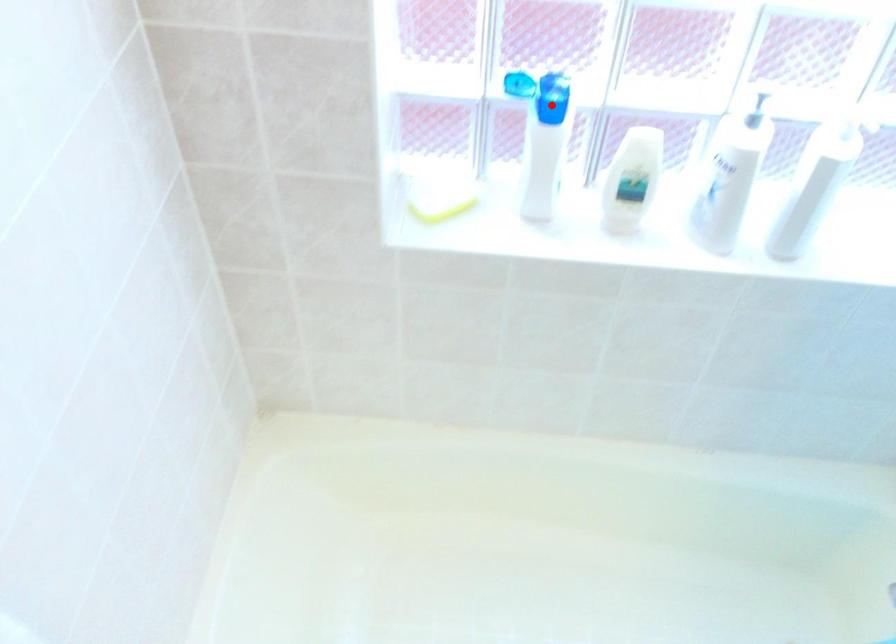
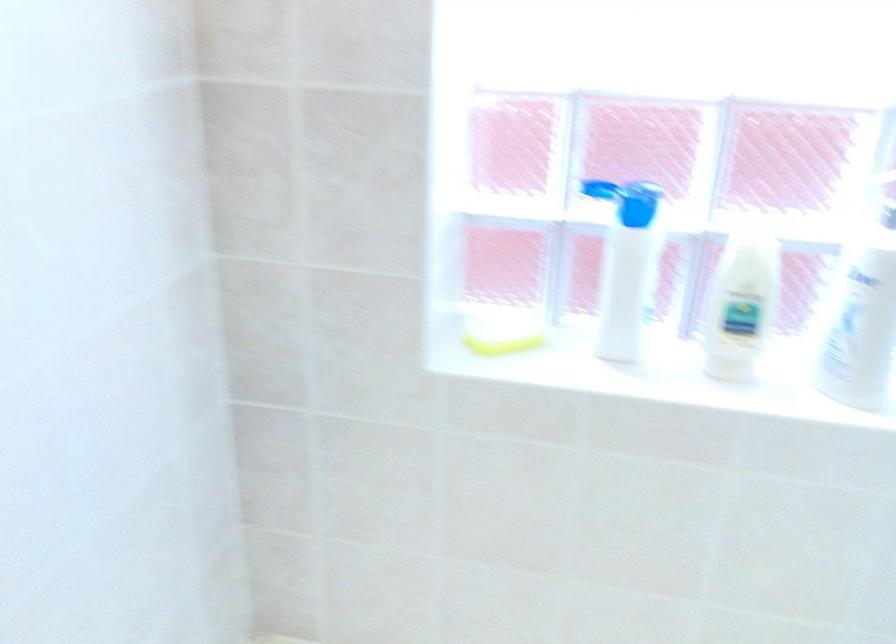
Where in the second image is the point corresponding to the highlighted location from the first image?

(636, 203)